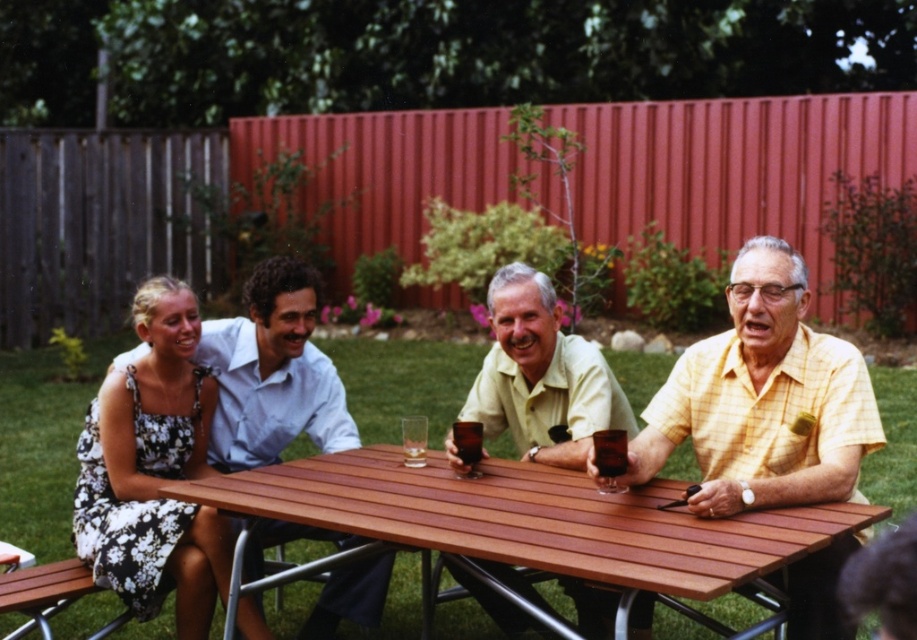
You are at a picnic table in a backyard with a group of friends. You have a floral dress at left and a translucent amber liquid at table center. Which object takes up more space?

The floral dress at left takes up more space than the translucent amber liquid at table center because it is bigger.